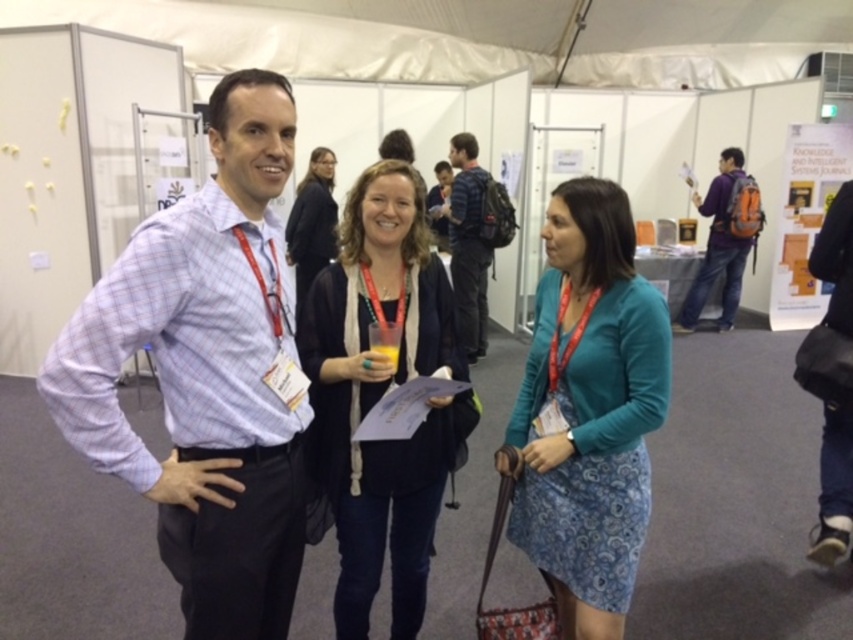
You are organizing a photo shoot and need to ensure that the matte black cardigan at center and the blue plaid shirt at center are both visible in the frame. Given their sizes, which item might require more careful positioning to avoid being cropped out?

The blue plaid shirt at center occupies more space than the matte black cardigan at center, so it might require more careful positioning to avoid being cropped out.

Looking at this image, you are an event photographer standing at the back of the tent. You need to capture a photo of both the blue printed dress at center and the blue plaid shirt at center in the same frame. Based on their positions, which one should you focus on first to ensure both are in the shot?

The blue printed dress at center is to the right of the blue plaid shirt at center, so you should focus on the blue plaid shirt at center first to ensure both are in the shot.

You are organizing a backpacking trip and need to choose between the orange backpack at right and the matte black jacket at center. Based on their sizes, which one would be more suitable for carrying camping gear?

The orange backpack at right is larger in size than the matte black jacket at center, so it would be more suitable for carrying camping gear.